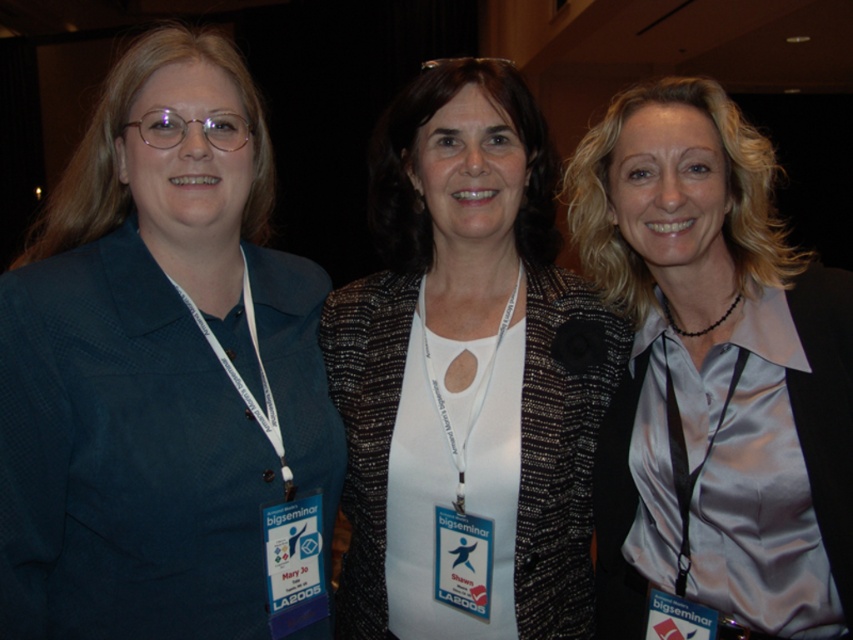
You are organizing a clothing donation drive and need to determine if the matte blue blazer at left and the speckled woolen jacket at center can fit into a standard donation box. The box can only accommodate items up to the size of the larger of the two jackets. Which jacket determines the maximum size requirement for the box?

The matte blue blazer at left is bigger than the speckled woolen jacket at center, so the box must be sized to accommodate the matte blue blazer at left.

You are organizing a photo shoot and need to arrange the matte blue blazer at left and the satin light gray blouse at center based on their heights. Which one should you place higher on the rack to ensure proper display?

The matte blue blazer at left should be placed higher on the rack since it has a greater height compared to the satin light gray blouse at center.

From the picture: You are standing in a conference room and see three women with lanyards. There is a speckled woolen jacket at center marked by point (468, 369). Which woman is wearing the speckled woolen jacket?

The speckled woolen jacket at center is represented by point (468, 369). The woman in the middle is wearing the speckled woolen jacket at center.